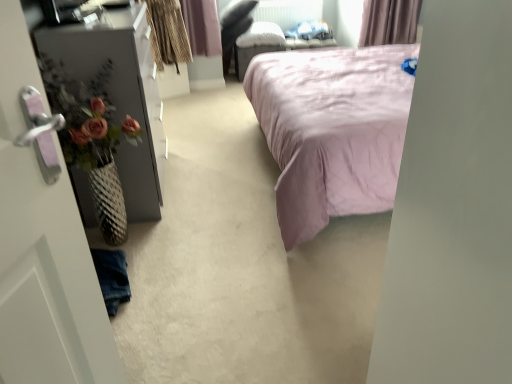
What do you see at coordinates (121, 95) in the screenshot?
I see `matte black dresser at left` at bounding box center [121, 95].

This screenshot has height=384, width=512. Find the location of `pink satin bed at center`. pink satin bed at center is located at coordinates (332, 130).

Where is `matte black dresser at left`? This screenshot has width=512, height=384. matte black dresser at left is located at coordinates (121, 95).

Can you confirm if white plastic radiator at upper center is taller than matte black dresser at left?

No, white plastic radiator at upper center is not taller than matte black dresser at left.

Visually, is white plastic radiator at upper center positioned to the left or to the right of matte black dresser at left?

From the image, it's evident that white plastic radiator at upper center is to the right of matte black dresser at left.

Is white plastic radiator at upper center next to matte black dresser at left and touching it?

No, white plastic radiator at upper center is not with matte black dresser at left.

Would you say white plastic radiator at upper center is outside matte black dresser at left?

Yes, white plastic radiator at upper center is not within matte black dresser at left.

Choose the correct answer: Is white plastic radiator at upper center inside pink satin bed at center or outside it?

white plastic radiator at upper center exists outside the volume of pink satin bed at center.

Considering the positions of objects white plastic radiator at upper center and pink satin bed at center in the image provided, who is behind, white plastic radiator at upper center or pink satin bed at center?

white plastic radiator at upper center is further from the camera.

Where is `radiator directly beneath the pink satin bed at center (from a real-world perspective)`? The image size is (512, 384). radiator directly beneath the pink satin bed at center (from a real-world perspective) is located at coordinates (288, 12).

How different are the orientations of white plastic radiator at upper center and pink satin bed at center in degrees?

90.8 degrees.

Who is smaller, matte black dresser at left or pink satin bed at center?

matte black dresser at left is smaller.

Does matte black dresser at left turn towards pink satin bed at center?

Yes, matte black dresser at left is aimed at pink satin bed at center.

Who is shorter, matte black dresser at left or pink satin bed at center?

Standing shorter between the two is matte black dresser at left.

In the image, is matte black dresser at left on the left side or the right side of pink satin bed at center?

matte black dresser at left is positioned on pink satin bed at center's left side.

Looking at the image, does pink satin bed at center seem bigger or smaller compared to white plastic radiator at upper center?

Considering their sizes, pink satin bed at center takes up more space than white plastic radiator at upper center.

Between pink satin bed at center and white plastic radiator at upper center, which one has less height?

white plastic radiator at upper center is shorter.

Is white plastic radiator at upper center surrounded by pink satin bed at center?

No.

From a real-world perspective, which object rests below the other?

white plastic radiator at upper center, from a real-world perspective.

Is pink satin bed at center beside matte black dresser at left?

They are not placed beside each other.

Is pink satin bed at center positioned with its back to matte black dresser at left?

No, pink satin bed at center's orientation is not away from matte black dresser at left.

Consider the image. From the image's perspective, who appears lower, pink satin bed at center or matte black dresser at left?

matte black dresser at left appears lower in the image.

Based on the photo, considering the sizes of objects pink satin bed at center and matte black dresser at left in the image provided, who is smaller, pink satin bed at center or matte black dresser at left?

Smaller between the two is matte black dresser at left.

Between matte black dresser at left and white plastic radiator at upper center, which one appears on the left side from the viewer's perspective?

From the viewer's perspective, matte black dresser at left appears more on the left side.

How distant is matte black dresser at left from white plastic radiator at upper center?

9.19 feet.

Find the location of a particular element. furniture that appears below the white plastic radiator at upper center (from the image's perspective) is located at coordinates (121, 95).

Does point (151, 133) appear closer or farther from the camera than point (306, 9)?

Point (151, 133) is closer to the camera than point (306, 9).

This screenshot has height=384, width=512. I want to click on furniture that appears in front of the white plastic radiator at upper center, so click(121, 95).

I want to click on bed below the white plastic radiator at upper center (from the image's perspective), so click(332, 130).

When comparing their distances from white plastic radiator at upper center, does pink satin bed at center or matte black dresser at left seem further?

matte black dresser at left is positioned further to the anchor white plastic radiator at upper center.

When comparing their distances from pink satin bed at center, does matte black dresser at left or white plastic radiator at upper center seem further?

white plastic radiator at upper center is positioned further to the anchor pink satin bed at center.

Considering their positions, is matte black dresser at left positioned closer to white plastic radiator at upper center than pink satin bed at center?

Among the two, pink satin bed at center is located nearer to white plastic radiator at upper center.

Considering their positions, is white plastic radiator at upper center positioned closer to matte black dresser at left than pink satin bed at center?

pink satin bed at center is positioned closer to the anchor matte black dresser at left.

Which object lies further to the anchor point matte black dresser at left, pink satin bed at center or white plastic radiator at upper center?

white plastic radiator at upper center is positioned further to the anchor matte black dresser at left.

In the scene shown: Considering their positions, is white plastic radiator at upper center positioned further to pink satin bed at center than matte black dresser at left?

The object further to pink satin bed at center is white plastic radiator at upper center.

Identify the location of furniture positioned between pink satin bed at center and white plastic radiator at upper center from near to far. (121, 95).